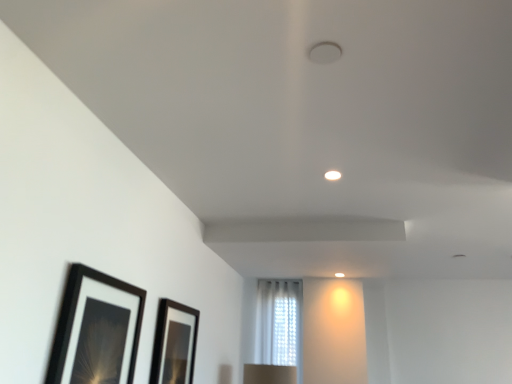
This screenshot has width=512, height=384. In order to click on black matte picture frame at lower left, placed as the 2th picture frame when sorted from right to left in this screenshot , I will do `click(96, 330)`.

The image size is (512, 384). Find the location of `white sheer curtain at center`. white sheer curtain at center is located at coordinates pos(278,323).

Is white sheer curtain at center wider or thinner than black matte picture frame at lower left, positioned as the first picture frame in left-to-right order?

Clearly, white sheer curtain at center has more width compared to black matte picture frame at lower left, positioned as the first picture frame in left-to-right order.

Which object is positioned more to the right, white sheer curtain at center or black matte picture frame at lower left, placed as the 2th picture frame when sorted from right to left?

From the viewer's perspective, white sheer curtain at center appears more on the right side.

From a real-world perspective, which object rests below the other?

black matte picture frame at lower left, which ranks as the second picture frame in back-to-front order, from a real-world perspective.

Considering the relative sizes of black matte picture frame at lower left, placed as the 2th picture frame when sorted from right to left, and white sheer curtain at center in the image provided, is black matte picture frame at lower left, placed as the 2th picture frame when sorted from right to left, taller than white sheer curtain at center?

No, black matte picture frame at lower left, placed as the 2th picture frame when sorted from right to left, is not taller than white sheer curtain at center.

How many degrees apart are the facing directions of black matte picture frame at lower left, positioned as the first picture frame in left-to-right order, and white sheer curtain at center?

The facing directions of black matte picture frame at lower left, positioned as the first picture frame in left-to-right order, and white sheer curtain at center are 88.2 degrees apart.

Between black glossy picture frame at lower center, the 1th picture frame positioned from the right, and white sheer curtain at center, which one has smaller width?

black glossy picture frame at lower center, the 1th picture frame positioned from the right, is thinner.

Considering the relative sizes of black glossy picture frame at lower center, the 1th picture frame positioned from the right, and white sheer curtain at center in the image provided, is black glossy picture frame at lower center, the 1th picture frame positioned from the right, taller than white sheer curtain at center?

No.

Is the position of black glossy picture frame at lower center, arranged as the second picture frame when viewed from the front, less distant than that of white sheer curtain at center?

Yes, it is.

Which of these two, black glossy picture frame at lower center, the 1th picture frame positioned from the right, or white sheer curtain at center, is smaller?

black glossy picture frame at lower center, the 1th picture frame positioned from the right.

Is black glossy picture frame at lower center, which is the second picture frame in left-to-right order, bigger than black matte picture frame at lower left, placed as the 2th picture frame when sorted from right to left?

Actually, black glossy picture frame at lower center, which is the second picture frame in left-to-right order, might be smaller than black matte picture frame at lower left, placed as the 2th picture frame when sorted from right to left.

Would you say black glossy picture frame at lower center, arranged as the second picture frame when viewed from the front, is a long distance from black matte picture frame at lower left, which is counted as the first picture frame, starting from the front?

No.

Does point (176, 383) come behind point (65, 330)?

Yes, it is.

Between black matte picture frame at lower left, positioned as the first picture frame in left-to-right order, and black glossy picture frame at lower center, the 1th picture frame positioned from the right, which one has more height?

Standing taller between the two is black glossy picture frame at lower center, the 1th picture frame positioned from the right.

Is black matte picture frame at lower left, which ranks as the second picture frame in back-to-front order, not close to black glossy picture frame at lower center, the 1th picture frame positioned from the right?

No, there isn't a large distance between black matte picture frame at lower left, which ranks as the second picture frame in back-to-front order, and black glossy picture frame at lower center, the 1th picture frame positioned from the right.

Does black matte picture frame at lower left, positioned as the first picture frame in left-to-right order, turn towards black glossy picture frame at lower center, the 1th picture frame positioned from the right?

No.

How many degrees apart are the facing directions of black matte picture frame at lower left, placed as the 2th picture frame when sorted from right to left, and black glossy picture frame at lower center, which is the second picture frame in left-to-right order?

1.11 degrees.

From a real-world perspective, between white sheer curtain at center and black glossy picture frame at lower center, which is the second picture frame in left-to-right order, who is vertically higher?

From a 3D spatial view, white sheer curtain at center is above.

Between white sheer curtain at center and black glossy picture frame at lower center, which ranks as the 1th picture frame in back-to-front order, which one has larger size?

With larger size is white sheer curtain at center.

From the image's perspective, is white sheer curtain at center above or below black glossy picture frame at lower center, the 1th picture frame positioned from the right?

white sheer curtain at center is below black glossy picture frame at lower center, the 1th picture frame positioned from the right.

In terms of width, does white sheer curtain at center look wider or thinner when compared to black glossy picture frame at lower center, which ranks as the 1th picture frame in back-to-front order?

Considering their sizes, white sheer curtain at center looks broader than black glossy picture frame at lower center, which ranks as the 1th picture frame in back-to-front order.

At what (x,y) coordinates should I click in order to perform the action: click on the 2nd picture frame to the left of the white sheer curtain at center, starting your count from the anchor. Please return your answer as a coordinate pair (x, y). Looking at the image, I should click on (96, 330).

You are a GUI agent. You are given a task and a screenshot of the screen. Output one action in this format:
    pyautogui.click(x=<x>, y=<y>)
    Task: Click on the window located on the right of black matte picture frame at lower left, which ranks as the second picture frame in back-to-front order
    The height and width of the screenshot is (384, 512).
    Given the screenshot: What is the action you would take?
    pyautogui.click(x=278, y=323)

Which object lies further to the anchor point white sheer curtain at center, black glossy picture frame at lower center, arranged as the second picture frame when viewed from the front, or black matte picture frame at lower left, which is counted as the first picture frame, starting from the front?

Among the two, black matte picture frame at lower left, which is counted as the first picture frame, starting from the front, is located further to white sheer curtain at center.

Looking at the image, which one is located closer to black glossy picture frame at lower center, arranged as the second picture frame when viewed from the front, black matte picture frame at lower left, placed as the 2th picture frame when sorted from right to left, or white sheer curtain at center?

black matte picture frame at lower left, placed as the 2th picture frame when sorted from right to left, is closer to black glossy picture frame at lower center, arranged as the second picture frame when viewed from the front.

Estimate the real-world distances between objects in this image. Which object is further from black matte picture frame at lower left, which ranks as the second picture frame in back-to-front order, white sheer curtain at center or black glossy picture frame at lower center, the 1th picture frame positioned from the right?

white sheer curtain at center is positioned further to the anchor black matte picture frame at lower left, which ranks as the second picture frame in back-to-front order.

Which object lies nearer to the anchor point black glossy picture frame at lower center, arranged as the second picture frame when viewed from the front, white sheer curtain at center or black matte picture frame at lower left, positioned as the first picture frame in left-to-right order?

black matte picture frame at lower left, positioned as the first picture frame in left-to-right order, is closer to black glossy picture frame at lower center, arranged as the second picture frame when viewed from the front.

Estimate the real-world distances between objects in this image. Which object is further from white sheer curtain at center, black matte picture frame at lower left, positioned as the first picture frame in left-to-right order, or black glossy picture frame at lower center, arranged as the second picture frame when viewed from the front?

Among the two, black matte picture frame at lower left, positioned as the first picture frame in left-to-right order, is located further to white sheer curtain at center.

Looking at the image, which one is located closer to black matte picture frame at lower left, placed as the 2th picture frame when sorted from right to left, black glossy picture frame at lower center, which ranks as the 1th picture frame in back-to-front order, or white sheer curtain at center?

Based on the image, black glossy picture frame at lower center, which ranks as the 1th picture frame in back-to-front order, appears to be nearer to black matte picture frame at lower left, placed as the 2th picture frame when sorted from right to left.

I want to click on picture frame positioned between black matte picture frame at lower left, placed as the 2th picture frame when sorted from right to left, and white sheer curtain at center from near to far, so click(174, 343).